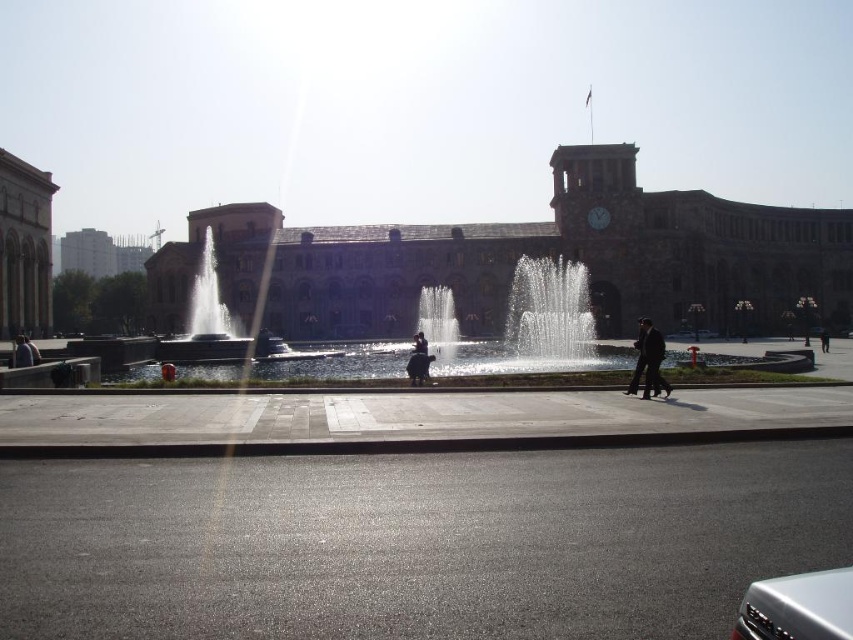
Question: Which point appears closest to the camera in this image?

Choices:
 (A) (190, 300)
 (B) (824, 326)
 (C) (585, 339)

Answer: (C)

Question: In this image, where is dark suit at center located relative to matte black jacket at lower left?

Choices:
 (A) above
 (B) below

Answer: (A)

Question: Is shiny metallic fountain at center left smaller than dark suit at center?

Choices:
 (A) yes
 (B) no

Answer: (B)

Question: Which object appears farthest from the camera in this image?

Choices:
 (A) dark blue jeans at center
 (B) black leather jacket at center
 (C) silver metallic car at lower right

Answer: (B)

Question: Which point appears closest to the camera in this image?

Choices:
 (A) (415, 365)
 (B) (849, 625)
 (C) (532, 317)

Answer: (B)

Question: Does matte black jacket at lower left have a smaller size compared to black leather jacket at center?

Choices:
 (A) no
 (B) yes

Answer: (B)